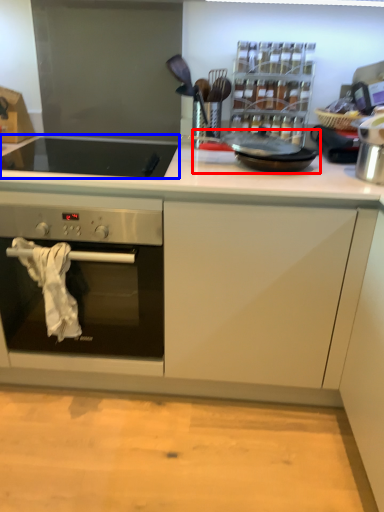
Question: Which object is closer to the camera taking this photo, frying pan (highlighted by a red box) or gas stove (highlighted by a blue box)?

Choices:
 (A) frying pan
 (B) gas stove

Answer: (B)